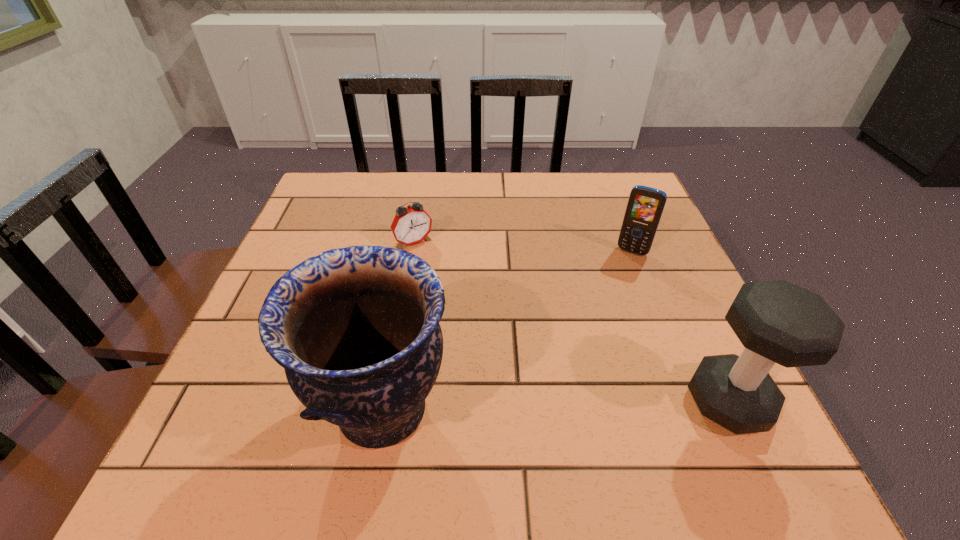
Locate an element on the screen. This screenshot has width=960, height=540. pottery is located at coordinates (356, 329).

The width and height of the screenshot is (960, 540). Find the location of `dumbbell`. dumbbell is located at coordinates (778, 322).

Where is `cellular telephone`? cellular telephone is located at coordinates (645, 206).

Locate an element on the screen. Image resolution: width=960 pixels, height=540 pixels. the shortest object is located at coordinates (411, 225).

You are a GUI agent. You are given a task and a screenshot of the screen. Output one action in this format:
    pyautogui.click(x=<x>, y=<y>)
    Task: Click on the vacant space located on the front handle of the pottery
    The height and width of the screenshot is (540, 960).
    Given the screenshot: What is the action you would take?
    pyautogui.click(x=273, y=409)

Where is `vacant space situated on the front handle of the pottery`? The image size is (960, 540). vacant space situated on the front handle of the pottery is located at coordinates (261, 409).

Find the location of a particular element. The height and width of the screenshot is (540, 960). free space located 0.100m on the front handle of the pottery is located at coordinates (255, 409).

Locate an element on the screen. free space located 0.240m on the left of the dumbbell is located at coordinates (550, 401).

This screenshot has width=960, height=540. Identify the location of free space located 0.290m on the screen of the third tallest object. (588, 342).

This screenshot has height=540, width=960. Identify the location of free space located 0.190m on the screen of the third tallest object. (603, 309).